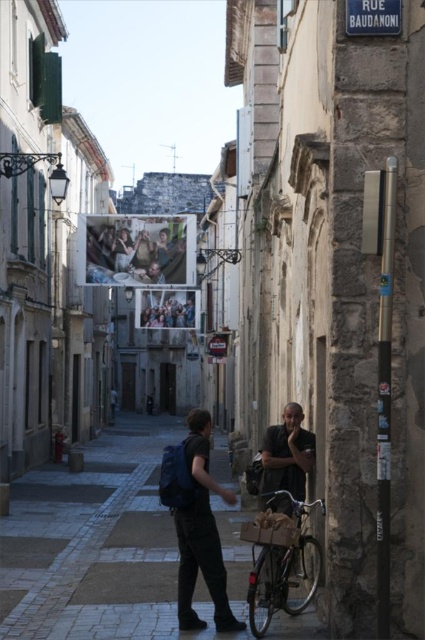
Question: Which object appears farthest from the camera in this image?

Choices:
 (A) matte plastic poster at center
 (B) matte blue backpack at center
 (C) cobblestone pavement at center

Answer: (A)

Question: Can you confirm if cobblestone pavement at center is positioned below metallic silver bicycle at lower right?

Choices:
 (A) yes
 (B) no

Answer: (A)

Question: Does metallic silver bicycle at lower right come in front of matte plastic poster at center?

Choices:
 (A) yes
 (B) no

Answer: (A)

Question: Among these objects, which one is nearest to the camera?

Choices:
 (A) metallic silver bicycle at lower right
 (B) dark gray fabric jacket at center
 (C) matte blue backpack at center

Answer: (A)

Question: Which point is closer to the camera?

Choices:
 (A) (297, 518)
 (B) (203, 435)
 (C) (170, 538)
 (D) (107, 269)

Answer: (B)

Question: Considering the relative positions of metallic silver bicycle at lower right and dark gray fabric jacket at center in the image provided, where is metallic silver bicycle at lower right located with respect to dark gray fabric jacket at center?

Choices:
 (A) above
 (B) below

Answer: (B)